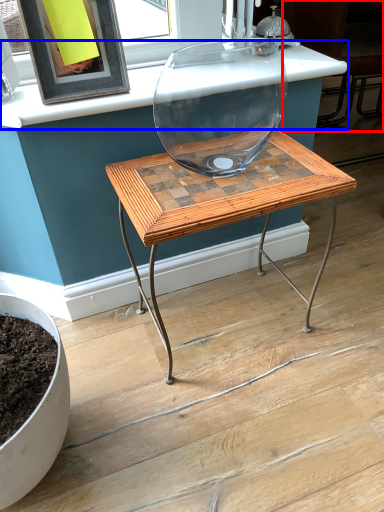
Question: Which object is closer to the camera taking this photo, chair (highlighted by a red box) or counter top (highlighted by a blue box)?

Choices:
 (A) chair
 (B) counter top

Answer: (B)